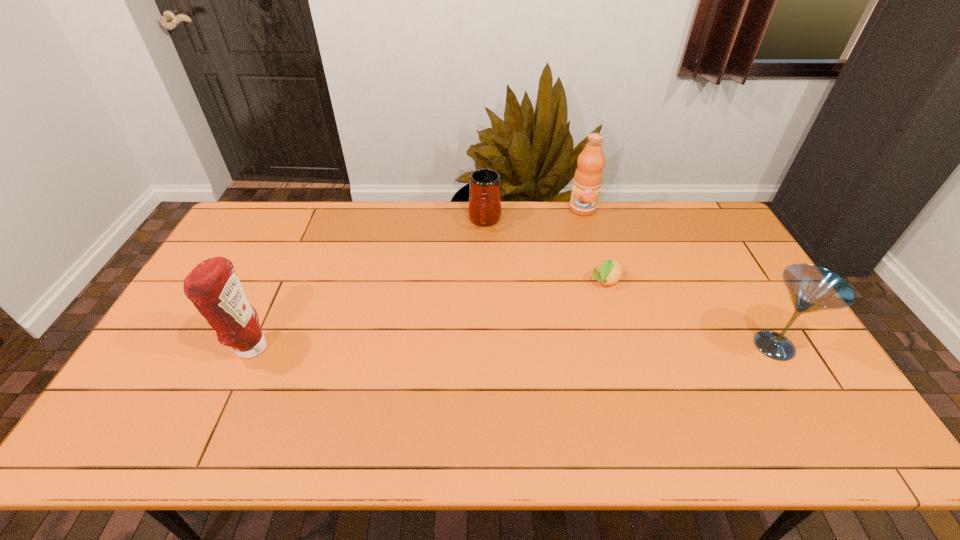
Locate an element on the screen. Image resolution: width=960 pixels, height=540 pixels. free space between the shortest object and the fruit juice is located at coordinates (594, 245).

Image resolution: width=960 pixels, height=540 pixels. I want to click on vacant area that lies between the fourth tallest object and the fruit juice, so click(x=534, y=215).

Where is `blank region between the fourth tallest object and the leftmost object`? The width and height of the screenshot is (960, 540). blank region between the fourth tallest object and the leftmost object is located at coordinates point(368,285).

Where is `vacant space in between the lemon and the leftmost object`? This screenshot has height=540, width=960. vacant space in between the lemon and the leftmost object is located at coordinates (428, 315).

Locate an element on the screen. Image resolution: width=960 pixels, height=540 pixels. free space between the leftmost object and the mug is located at coordinates (368, 285).

Where is `vacant area between the condiment and the fruit juice`? Image resolution: width=960 pixels, height=540 pixels. vacant area between the condiment and the fruit juice is located at coordinates (417, 279).

At what (x,y) coordinates should I click in order to perform the action: click on free area in between the third tallest object and the fruit juice. Please return your answer as a coordinate pair (x, y). Looking at the image, I should click on (678, 278).

Where is `object that is the third closest one to the shortest object`? object that is the third closest one to the shortest object is located at coordinates (484, 209).

Locate an element on the screen. object identified as the closest to the shortest object is located at coordinates (588, 176).